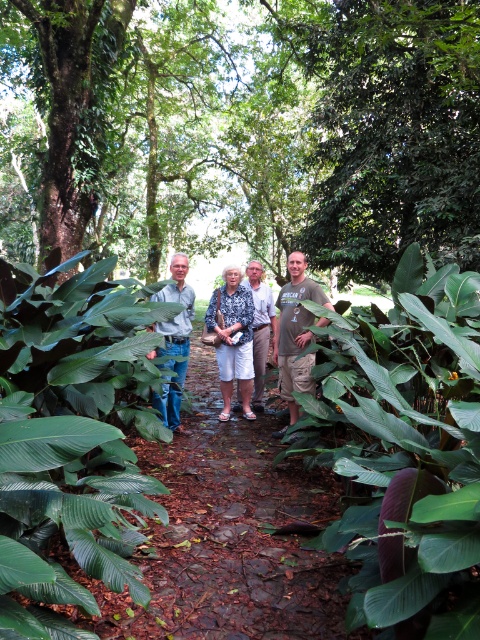
You are a hiker trying to navigate a narrow path surrounded by greenery. You see two points marked on the path. The first point is at coordinates point (468, 74) and the second point is at point (309, 294). Which point is closer to you as you stand on the path?

Point (468, 74) is further to the viewer than point (309, 294), so the second point is closer to you.